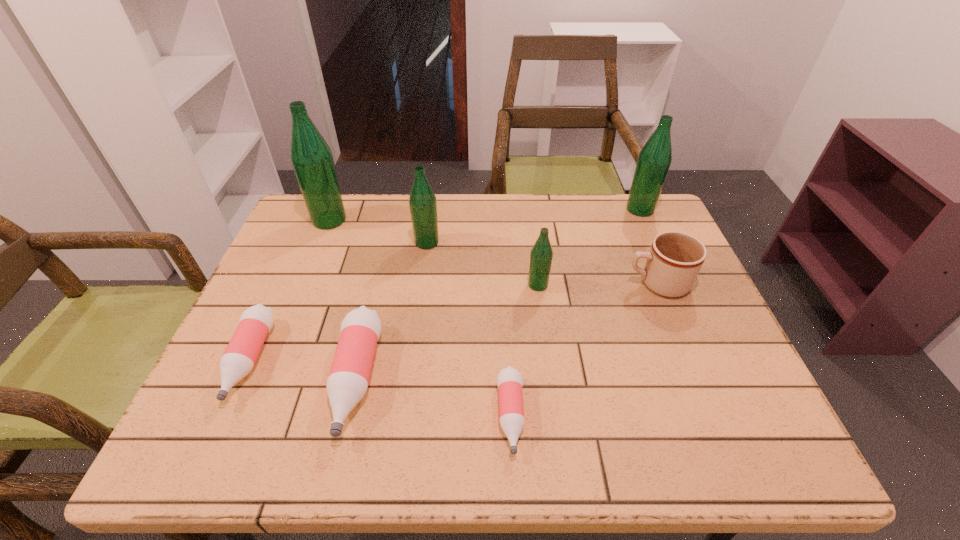
Locate an element on the screen. The height and width of the screenshot is (540, 960). free space between the second smallest pink bottle and the shortest bottle is located at coordinates (380, 388).

What are the coordinates of `object that is the second closest to the sixth bottle from left to right` in the screenshot? It's located at (511, 410).

Select which object appears as the fourth closest to the tallest bottle. Please provide its 2D coordinates. Your answer should be formatted as a tuple, i.e. [(x, y)], where the tuple contains the x and y coordinates of a point satisfying the conditions above.

[(541, 255)]

Where is `bottle identified as the closest to the mug`? Image resolution: width=960 pixels, height=540 pixels. bottle identified as the closest to the mug is located at coordinates click(541, 255).

Find the location of `the closest bottle to the leftmost green bottle`. the closest bottle to the leftmost green bottle is located at coordinates [x=422, y=202].

Where is `the closest green bottle to the second shortest object`? The image size is (960, 540). the closest green bottle to the second shortest object is located at coordinates (x=311, y=158).

Locate an element on the screen. The width and height of the screenshot is (960, 540). the closest green bottle to the third smallest green bottle is located at coordinates (541, 255).

Identify which pink bottle is the third closest to the fifth tallest object. Please provide its 2D coordinates. Your answer should be formatted as a tuple, i.e. [(x, y)], where the tuple contains the x and y coordinates of a point satisfying the conditions above.

[(255, 323)]

This screenshot has height=540, width=960. Identify the location of pink bottle that can be found as the closest to the shortest object. (347, 383).

You are a GUI agent. You are given a task and a screenshot of the screen. Output one action in this format:
    pyautogui.click(x=<x>, y=<y>)
    Task: Click on the free space that satisfies the following two spatial constraints: 1. on the side of the mug with the handle; 2. on the right side of the second biggest green bottle
    
    Given the screenshot: What is the action you would take?
    pyautogui.click(x=627, y=210)